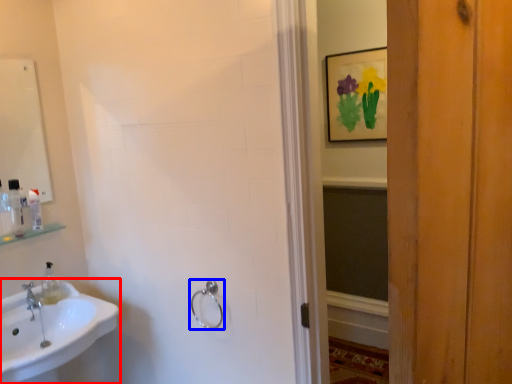
Question: Which of the following is the closest to the observer, sink (highlighted by a red box) or towel rack (highlighted by a blue box)?

Choices:
 (A) sink
 (B) towel rack

Answer: (A)